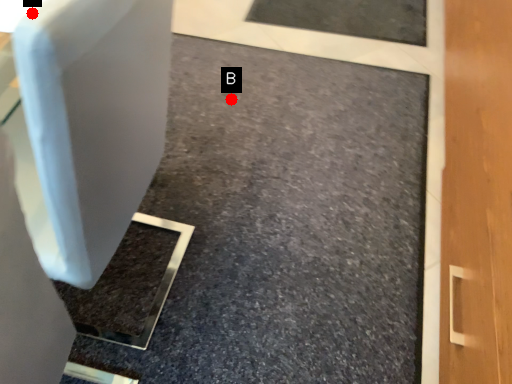
Question: Two points are circled on the image, labeled by A and B beside each circle. Which of the following is the farthest from the observer?

Choices:
 (A) A is further
 (B) B is further

Answer: (B)